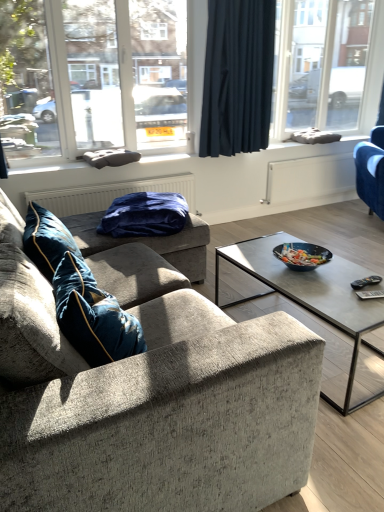
Question: Is transparent glass window at upper right, the first window from the back, next to velvet blue armchair at right, acting as the first studio couch starting from the right, and touching it?

Choices:
 (A) yes
 (B) no

Answer: (B)

Question: Does transparent glass window at upper right, the second window when ordered from front to back, have a larger size compared to velvet blue armchair at right, acting as the first studio couch starting from the right?

Choices:
 (A) yes
 (B) no

Answer: (B)

Question: From the image's perspective, would you say transparent glass window at upper right, the 2th window in the left-to-right sequence, is shown under velvet blue armchair at right, which ranks as the 1th studio couch in back-to-front order?

Choices:
 (A) no
 (B) yes

Answer: (A)

Question: Does transparent glass window at upper right, the 2th window in the left-to-right sequence, have a greater height compared to velvet blue armchair at right, acting as the first studio couch starting from the right?

Choices:
 (A) yes
 (B) no

Answer: (A)

Question: From a real-world perspective, is transparent glass window at upper right, the second window when ordered from front to back, physically below velvet blue armchair at right, which is the 2th studio couch in left-to-right order?

Choices:
 (A) no
 (B) yes

Answer: (A)

Question: Is transparent glass window at upper left, the second window positioned from the right, inside or outside of textured gray couch at center, which is the first studio couch in left-to-right order?

Choices:
 (A) inside
 (B) outside

Answer: (B)

Question: In terms of height, does transparent glass window at upper left, which ranks as the 1th window in front-to-back order, look taller or shorter compared to textured gray couch at center, which is the first studio couch in left-to-right order?

Choices:
 (A) tall
 (B) short

Answer: (A)

Question: Based on their sizes in the image, would you say transparent glass window at upper left, the second window positioned from the right, is bigger or smaller than textured gray couch at center, arranged as the 2th studio couch when viewed from the back?

Choices:
 (A) small
 (B) big

Answer: (A)

Question: Is point (34, 89) closer or farther from the camera than point (14, 211)?

Choices:
 (A) closer
 (B) farther

Answer: (B)

Question: Looking at their shapes, would you say transparent glass window at upper right, the second window when ordered from front to back, is wider or thinner than dark blue fabric curtain at upper center?

Choices:
 (A) thin
 (B) wide

Answer: (A)

Question: From the image's perspective, is transparent glass window at upper right, the second window when ordered from front to back, above or below dark blue fabric curtain at upper center?

Choices:
 (A) below
 (B) above

Answer: (B)

Question: Is transparent glass window at upper right, the 2th window in the left-to-right sequence, situated inside dark blue fabric curtain at upper center or outside?

Choices:
 (A) inside
 (B) outside

Answer: (B)

Question: From a real-world perspective, is transparent glass window at upper right, the second window when ordered from front to back, positioned above or below dark blue fabric curtain at upper center?

Choices:
 (A) below
 (B) above

Answer: (B)

Question: Looking at the image, does dark blue fabric curtain at upper center seem bigger or smaller compared to textured gray couch at center, the 1th studio couch from the front?

Choices:
 (A) big
 (B) small

Answer: (B)

Question: From the image's perspective, is dark blue fabric curtain at upper center located above or below textured gray couch at center, arranged as the 2th studio couch when viewed from the back?

Choices:
 (A) above
 (B) below

Answer: (A)